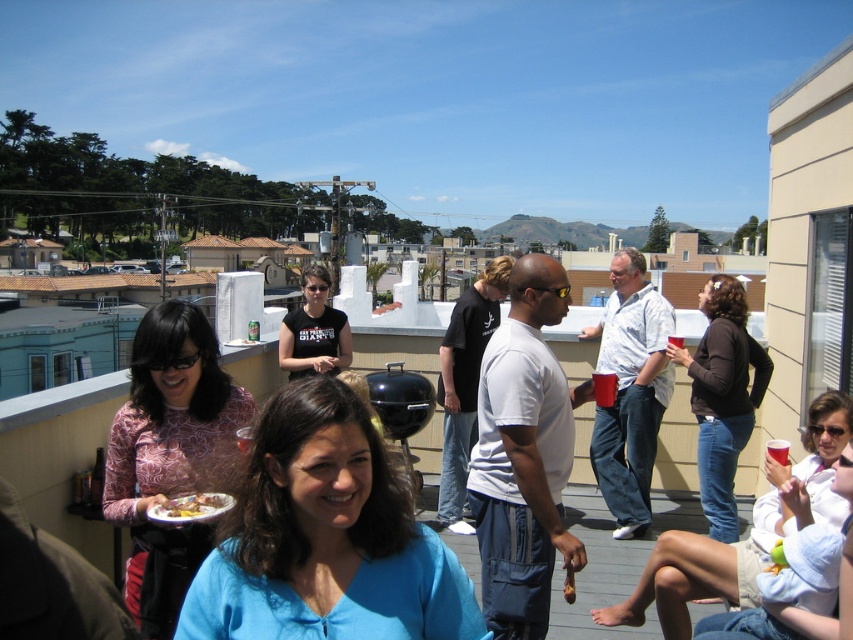
Question: Where is blue matte shirt at center located in relation to golden brown bread at lower left in the image?

Choices:
 (A) left
 (B) right

Answer: (B)

Question: Which of the following is the closest to the observer?

Choices:
 (A) blue matte shirt at center
 (B) golden brown bread at lower left
 (C) dark brown sweater at center
 (D) black t-shirt at center

Answer: (A)

Question: Can you confirm if light brown fabric shorts at lower right is positioned to the right of golden brown bread at lower left?

Choices:
 (A) no
 (B) yes

Answer: (B)

Question: Based on their relative distances, which object is nearer to the golden brown bread at lower left?

Choices:
 (A) patterned fabric shirt at left
 (B) dark brown sweater at center

Answer: (A)

Question: Which is farther from the patterned fabric shirt at left?

Choices:
 (A) blue matte shirt at center
 (B) black t-shirt at center

Answer: (B)

Question: Is dark brown sweater at center wider than black t-shirt at center?

Choices:
 (A) yes
 (B) no

Answer: (B)